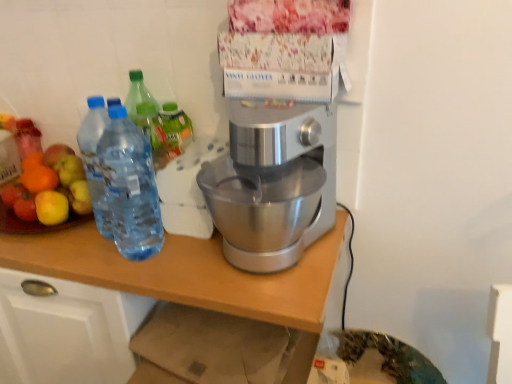
Question: Can you confirm if shiny plastic fruit salad at left is wider than silver metallic table at center?

Choices:
 (A) no
 (B) yes

Answer: (A)

Question: Does shiny plastic fruit salad at left have a smaller size compared to silver metallic table at center?

Choices:
 (A) no
 (B) yes

Answer: (B)

Question: From the image's perspective, is shiny plastic fruit salad at left located above silver metallic table at center?

Choices:
 (A) no
 (B) yes

Answer: (B)

Question: Considering the relative sizes of shiny plastic fruit salad at left and silver metallic table at center in the image provided, is shiny plastic fruit salad at left thinner than silver metallic table at center?

Choices:
 (A) yes
 (B) no

Answer: (A)

Question: Considering the relative positions of shiny plastic fruit salad at left and silver metallic table at center in the image provided, is shiny plastic fruit salad at left behind silver metallic table at center?

Choices:
 (A) no
 (B) yes

Answer: (B)

Question: Is shiny plastic fruit salad at left to the left of silver metallic table at center from the viewer's perspective?

Choices:
 (A) no
 (B) yes

Answer: (B)

Question: Is shiny plastic fruit salad at left in contact with transparent plastic bottles at left?

Choices:
 (A) no
 (B) yes

Answer: (A)

Question: Can you confirm if shiny plastic fruit salad at left is shorter than transparent plastic bottles at left?

Choices:
 (A) yes
 (B) no

Answer: (A)

Question: Is shiny plastic fruit salad at left taller than transparent plastic bottles at left?

Choices:
 (A) yes
 (B) no

Answer: (B)

Question: Is shiny plastic fruit salad at left bigger than transparent plastic bottles at left?

Choices:
 (A) no
 (B) yes

Answer: (B)

Question: From the image's perspective, does shiny plastic fruit salad at left appear lower than transparent plastic bottles at left?

Choices:
 (A) yes
 (B) no

Answer: (B)

Question: Is shiny plastic fruit salad at left aimed at transparent plastic bottles at left?

Choices:
 (A) yes
 (B) no

Answer: (B)

Question: Is silver metallic stand mixer at center at the right side of silver metallic table at center?

Choices:
 (A) yes
 (B) no

Answer: (A)